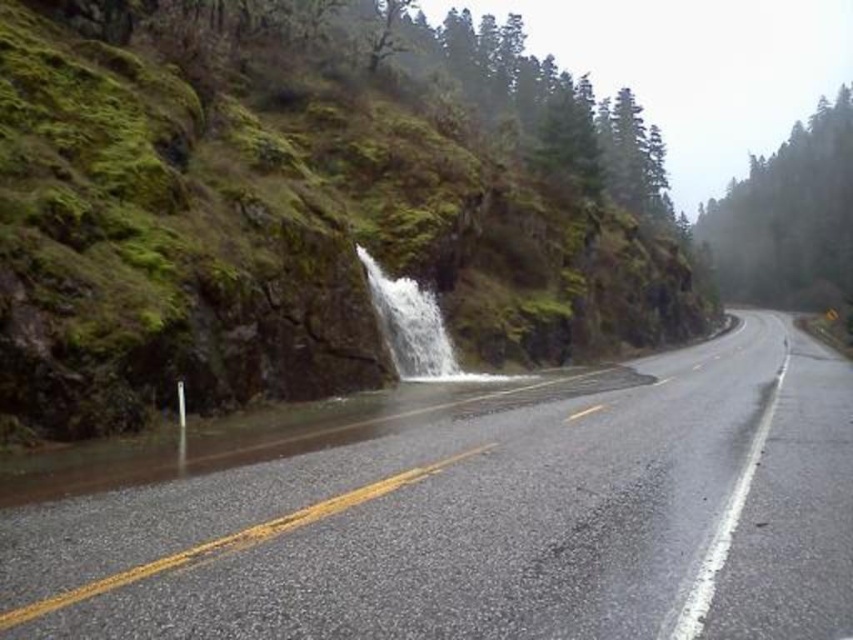
Who is positioned more to the right, green mossy rock at center or clear water at center?

green mossy rock at center is more to the right.

Who is positioned more to the left, green mossy rock at center or clear water at center?

clear water at center is more to the left.

Is point (39, 122) closer to viewer compared to point (386, 280)?

Yes, point (39, 122) is in front of point (386, 280).

The height and width of the screenshot is (640, 853). In order to click on green mossy rock at center in this screenshot , I will do `click(305, 205)`.

Can you confirm if green mossy rock at center is positioned below glossy asphalt highway at center?

No.

Is green mossy rock at center taller than glossy asphalt highway at center?

Indeed, green mossy rock at center has a greater height compared to glossy asphalt highway at center.

Which is in front, point (538, 145) or point (805, 540)?

Point (805, 540) is in front.

Image resolution: width=853 pixels, height=640 pixels. Identify the location of green mossy rock at center. (305, 205).

Does glossy asphalt highway at center appear over clear water at center?

No, glossy asphalt highway at center is not above clear water at center.

Does glossy asphalt highway at center have a lesser width compared to clear water at center?

In fact, glossy asphalt highway at center might be wider than clear water at center.

The height and width of the screenshot is (640, 853). Describe the element at coordinates (483, 513) in the screenshot. I see `glossy asphalt highway at center` at that location.

In order to click on glossy asphalt highway at center in this screenshot , I will do `click(483, 513)`.